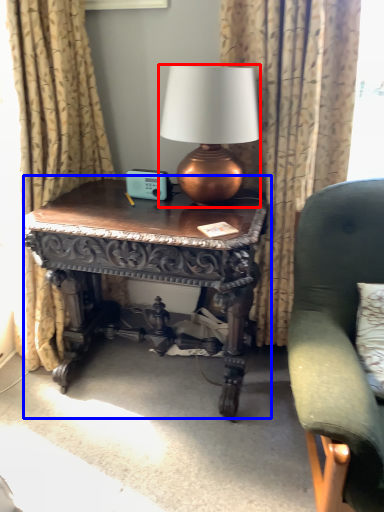
Question: Among these objects, which one is nearest to the camera, lamp (highlighted by a red box) or table (highlighted by a blue box)?

Choices:
 (A) lamp
 (B) table

Answer: (A)